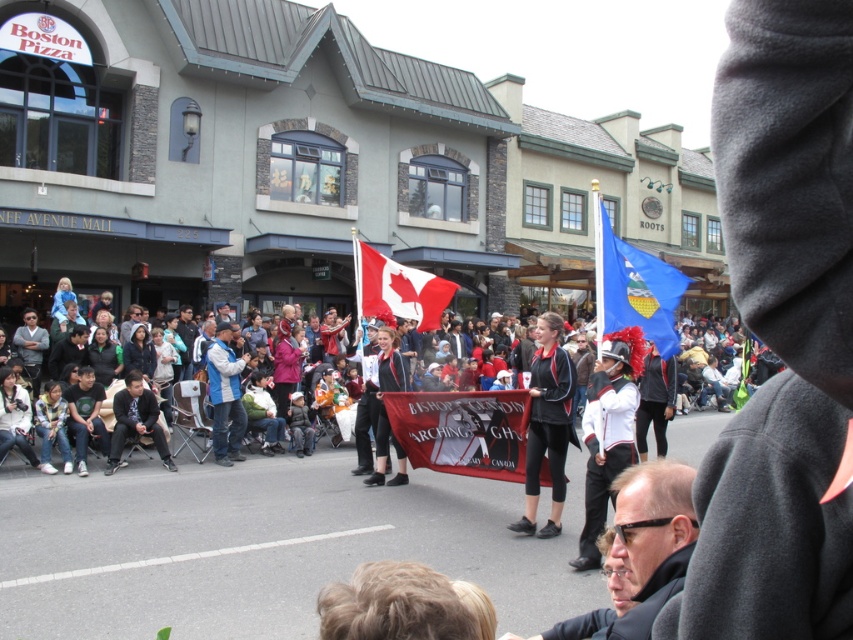
You are a photographer trying to capture both the black leather jacket at center and the matte black jacket at center in the same frame. Given their sizes, which jacket will appear larger in your photo?

The matte black jacket at center will appear larger in the photo because it is bigger than the black leather jacket at center.

You are a photographer at the parade and want to capture both the black leather jacket at center and the matte black jacket at center in a single shot. Which jacket should you position to the left side of your frame to ensure both are included?

You should position the matte black jacket at center to the left side of your frame because the black leather jacket at center is already to the right of it.